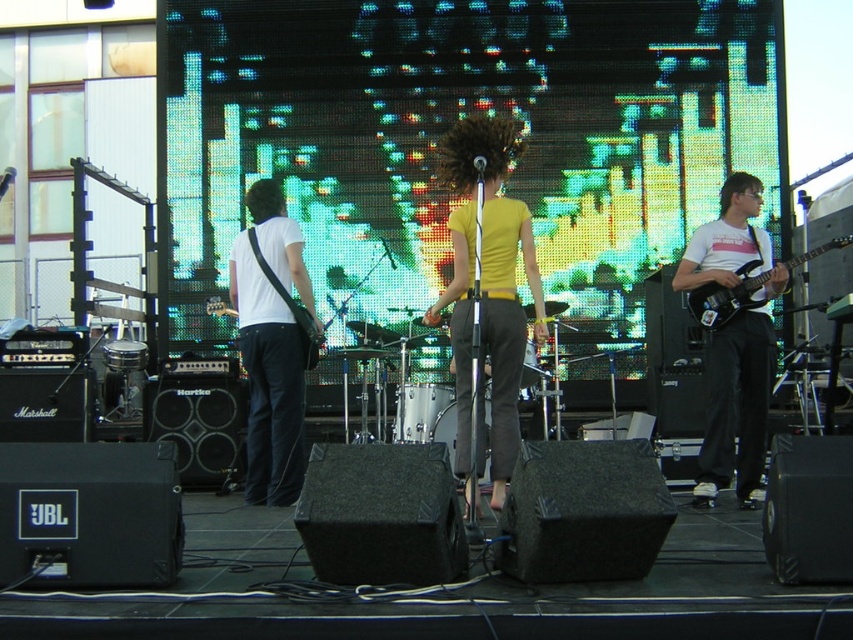
Question: From the image, what is the correct spatial relationship of yellow matte shirt at center in relation to matte black guitar at left?

Choices:
 (A) left
 (B) right

Answer: (B)

Question: Which of these objects is positioned farthest from the white matte shirt at left?

Choices:
 (A) yellow matte shirt at center
 (B) matte black electric guitar at right
 (C) black glossy electric guitar at right

Answer: (B)

Question: Is black glossy electric guitar at right to the right of white matte shirt at left from the viewer's perspective?

Choices:
 (A) no
 (B) yes

Answer: (B)

Question: Considering the relative positions of yellow matte shirt at center and matte black guitar at left in the image provided, where is yellow matte shirt at center located with respect to matte black guitar at left?

Choices:
 (A) below
 (B) above

Answer: (A)

Question: Which point is closer to the camera?

Choices:
 (A) (701, 276)
 (B) (294, 317)
 (C) (706, 330)

Answer: (A)

Question: Among these objects, which one is nearest to the camera?

Choices:
 (A) white matte shirt at left
 (B) matte black electric guitar at right
 (C) black glossy electric guitar at right

Answer: (B)